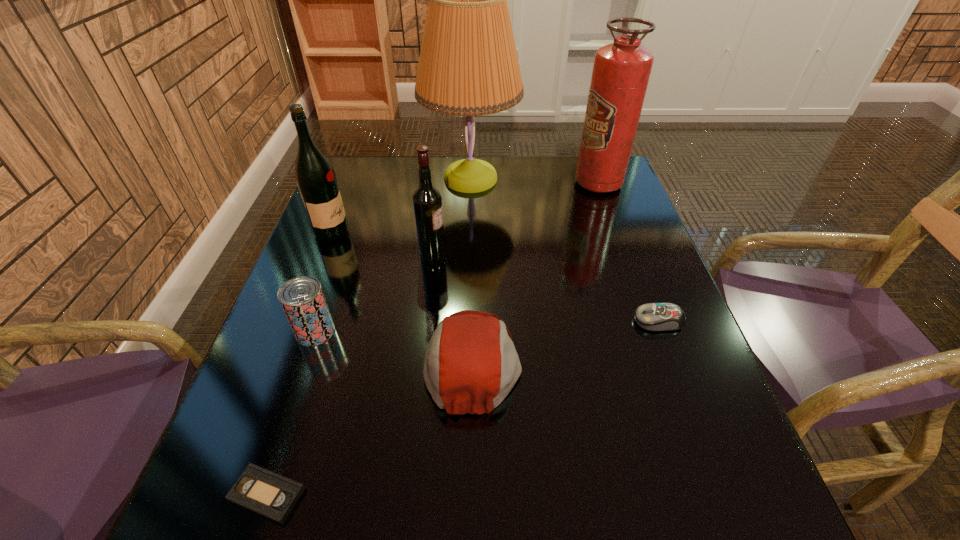
This screenshot has height=540, width=960. I want to click on vacant space that's between the beer can and the liquor, so click(x=324, y=282).

Locate an element on the screen. The width and height of the screenshot is (960, 540). vacant space that is in between the shortest object and the fourth tallest object is located at coordinates (350, 376).

Locate an element on the screen. This screenshot has height=540, width=960. unoccupied position between the cap and the lamp is located at coordinates (471, 270).

Where is `free space between the liquor and the nearest object`? The width and height of the screenshot is (960, 540). free space between the liquor and the nearest object is located at coordinates (300, 363).

You are a GUI agent. You are given a task and a screenshot of the screen. Output one action in this format:
    pyautogui.click(x=<x>, y=<y>)
    Task: Click on the free spot between the fire extinguisher and the cap
    This screenshot has height=540, width=960.
    Given the screenshot: What is the action you would take?
    pyautogui.click(x=536, y=272)

Locate an element on the screen. The image size is (960, 540). free space between the lamp and the videotape is located at coordinates (369, 336).

The width and height of the screenshot is (960, 540). I want to click on blank region between the sixth nearest object and the wine bottle, so click(x=382, y=245).

At what (x,y) coordinates should I click in order to perform the action: click on the seventh closest object to the fourth farthest object. Please return your answer as a coordinate pair (x, y). This screenshot has height=540, width=960. Looking at the image, I should click on (273, 496).

Locate an element on the screen. The image size is (960, 540). object that can be found as the third closest to the lamp is located at coordinates (316, 180).

Find the location of a particular element. The image size is (960, 540). vacant space that satisfies the following two spatial constraints: 1. on the front and back of the wine bottle; 2. on the front side of the nearest object is located at coordinates (405, 494).